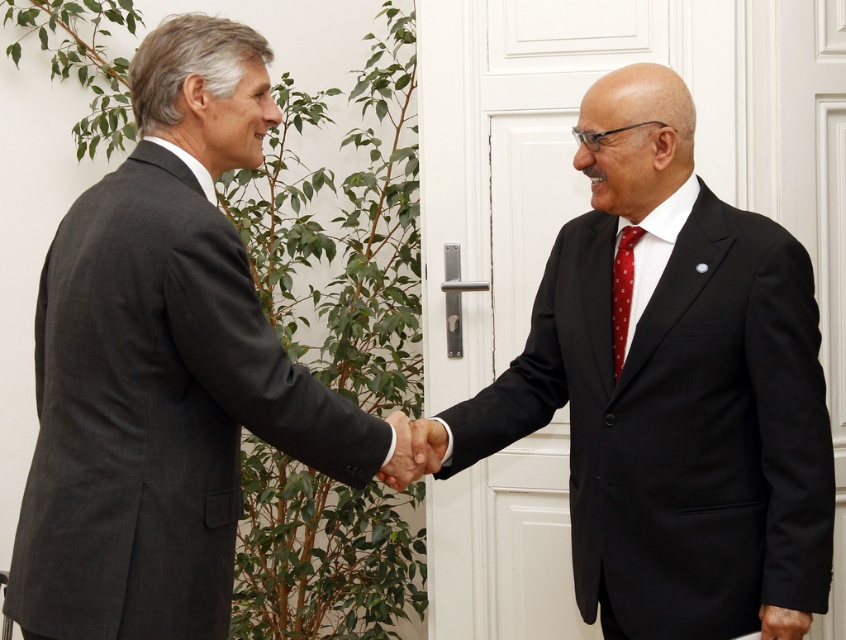
Question: Estimate the real-world distances between objects in this image. Which object is farther from the black smooth hand at center?

Choices:
 (A) red dotted tie at right
 (B) black leather hand at lower right

Answer: (B)

Question: Which point is closer to the camera?

Choices:
 (A) red dotted tie at right
 (B) black matte suit at center

Answer: (B)

Question: Can you confirm if black smooth hand at center is positioned below red dotted tie at right?

Choices:
 (A) yes
 (B) no

Answer: (A)

Question: Is black matte suit at center above red dotted tie at right?

Choices:
 (A) yes
 (B) no

Answer: (B)

Question: Is black matte suit at center smaller than black smooth hand at center?

Choices:
 (A) yes
 (B) no

Answer: (B)

Question: Which point is farther to the camera?

Choices:
 (A) red dotted tie at right
 (B) dark gray suit at left
 (C) black leather hand at lower right

Answer: (B)